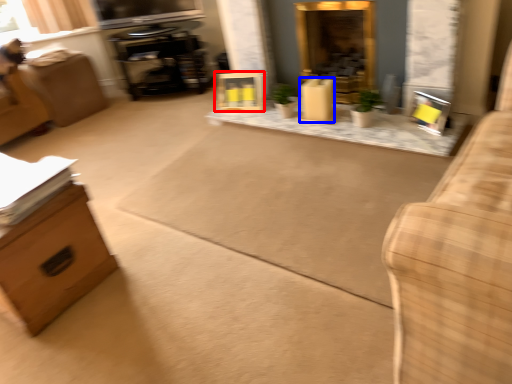
Question: Which object appears farthest to the camera in this image, picture frame (highlighted by a red box) or box (highlighted by a blue box)?

Choices:
 (A) picture frame
 (B) box

Answer: (A)